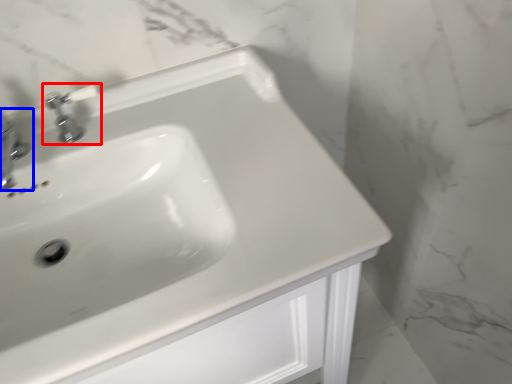
Question: Which object is further to the camera taking this photo, tap (highlighted by a red box) or tap (highlighted by a blue box)?

Choices:
 (A) tap
 (B) tap

Answer: (A)